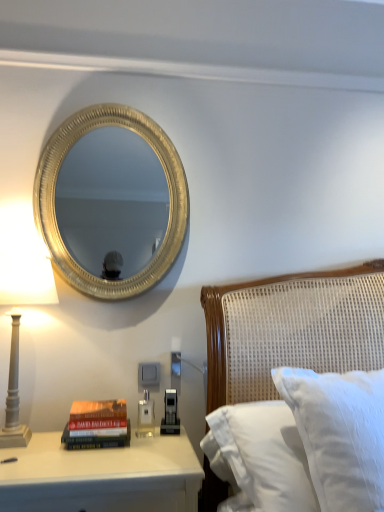
Question: Is white textured pillow at right at the right side of gold textured mirror at upper left?

Choices:
 (A) no
 (B) yes

Answer: (B)

Question: Can you confirm if white textured pillow at right is smaller than gold textured mirror at upper left?

Choices:
 (A) yes
 (B) no

Answer: (B)

Question: Considering the relative positions of white textured pillow at right and gold textured mirror at upper left in the image provided, is white textured pillow at right to the left of gold textured mirror at upper left from the viewer's perspective?

Choices:
 (A) yes
 (B) no

Answer: (B)

Question: Is gold textured mirror at upper left inside white textured pillow at right?

Choices:
 (A) no
 (B) yes

Answer: (A)

Question: Is white textured pillow at right not near gold textured mirror at upper left?

Choices:
 (A) no
 (B) yes

Answer: (B)

Question: Visually, is gray columnar lamp at left positioned to the left or to the right of white glossy nightstand at lower left?

Choices:
 (A) left
 (B) right

Answer: (A)

Question: Which is correct: gray columnar lamp at left is inside white glossy nightstand at lower left, or outside of it?

Choices:
 (A) inside
 (B) outside

Answer: (B)

Question: Is gray columnar lamp at left taller or shorter than white glossy nightstand at lower left?

Choices:
 (A) short
 (B) tall

Answer: (B)

Question: Considering their positions, is gray columnar lamp at left located in front of or behind white glossy nightstand at lower left?

Choices:
 (A) behind
 (B) front

Answer: (A)

Question: In terms of width, does white glossy nightstand at lower left look wider or thinner when compared to white textured pillow at right?

Choices:
 (A) wide
 (B) thin

Answer: (A)

Question: Would you say white glossy nightstand at lower left is inside or outside white textured pillow at right?

Choices:
 (A) outside
 (B) inside

Answer: (A)

Question: In the image, is white glossy nightstand at lower left on the left side or the right side of white textured pillow at right?

Choices:
 (A) right
 (B) left

Answer: (B)

Question: Is white glossy nightstand at lower left taller or shorter than white textured pillow at right?

Choices:
 (A) tall
 (B) short

Answer: (B)

Question: Is hardcover book at lower left situated inside white glossy nightstand at lower left or outside?

Choices:
 (A) outside
 (B) inside

Answer: (A)

Question: From the image's perspective, is hardcover book at lower left above or below white glossy nightstand at lower left?

Choices:
 (A) above
 (B) below

Answer: (A)